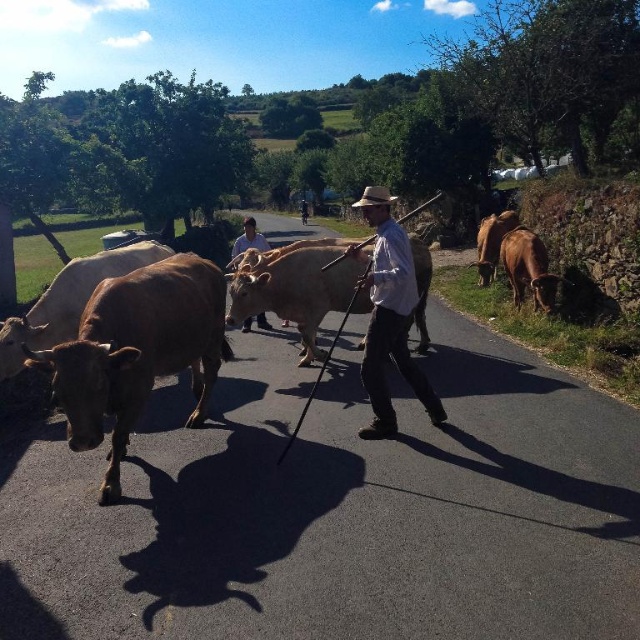
You are a farmer assessing the space needed to separate the bulls. The brown matte bull at right and the brown glossy bull at right are both in the same area. Which bull requires more space due to its size?

The brown glossy bull at right requires more space because its width is greater than the brown matte bull at right.

You are a drone operator trying to capture a photo of the man herding cows. The drone is currently above the scene. Which object, the brown matte bull at right or the white shirt at center, is closer to the drone?

The brown matte bull at right is closer to the drone because the white shirt at center is behind it.